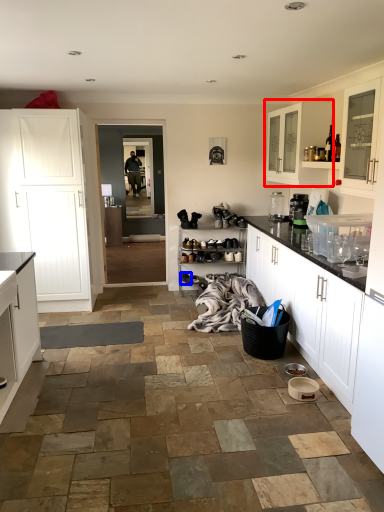
Question: Which object appears closest to the camera in this image, cabinetry (highlighted by a red box) or footwear (highlighted by a blue box)?

Choices:
 (A) cabinetry
 (B) footwear

Answer: (A)